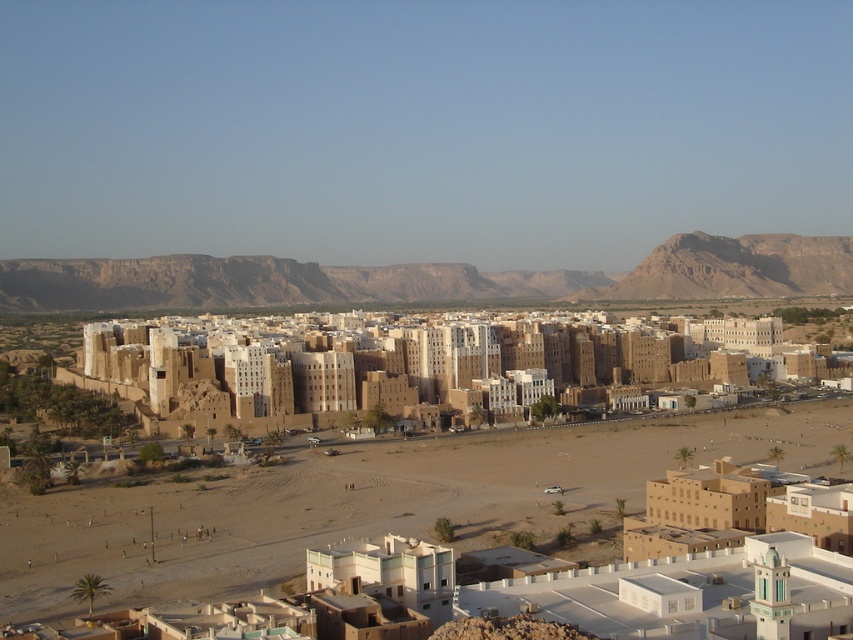
Question: Which point is closer to the camera?

Choices:
 (A) brown rocky mountain at upper right
 (B) brown sand at lower center
 (C) brown rocky mountain at center

Answer: (B)

Question: Does brown mud-brick buildings at center appear on the left side of brown rocky mountain at upper right?

Choices:
 (A) yes
 (B) no

Answer: (A)

Question: Does brown mud-brick buildings at center appear on the right side of brown rocky mountain at center?

Choices:
 (A) no
 (B) yes

Answer: (A)

Question: Which point is closer to the camera taking this photo?

Choices:
 (A) (392, 394)
 (B) (817, 273)
 (C) (792, 252)

Answer: (A)

Question: Is brown mud-brick buildings at center behind brown rocky mountain at upper right?

Choices:
 (A) no
 (B) yes

Answer: (A)

Question: Among these objects, which one is nearest to the camera?

Choices:
 (A) brown rocky mountain at center
 (B) brown rocky mountain at upper right
 (C) brown mud-brick buildings at center
 (D) brown sand at lower center

Answer: (D)